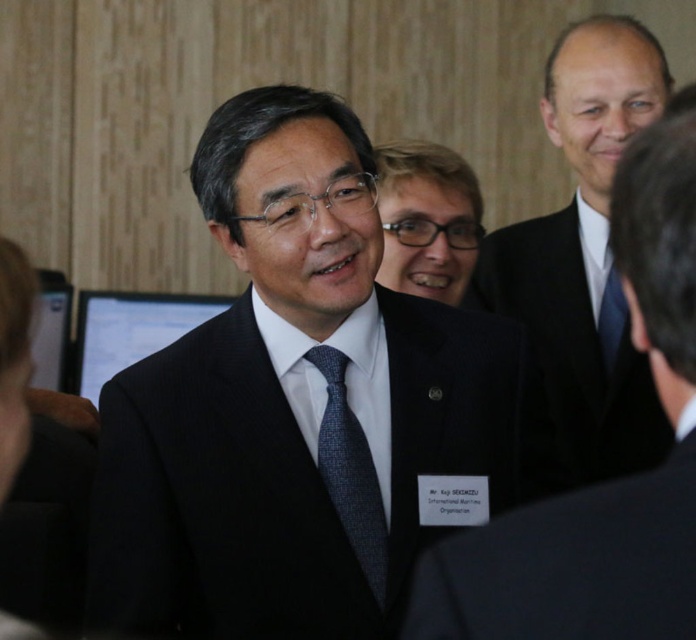
Question: Can you confirm if matte black suit at center is smaller than matte black monitor at left?

Choices:
 (A) no
 (B) yes

Answer: (B)

Question: Is black matte suit at center positioned in front of blue silk tie at right?

Choices:
 (A) no
 (B) yes

Answer: (B)

Question: Estimate the real-world distances between objects in this image. Which object is closer to the black matte suit at center?

Choices:
 (A) matte black monitor at center
 (B) matte black monitor at left

Answer: (A)

Question: Where is black matte suit at center located in relation to blue textured tie at center in the image?

Choices:
 (A) left
 (B) right

Answer: (B)

Question: Which point is closer to the camera?

Choices:
 (A) (335, 461)
 (B) (500, 561)

Answer: (B)

Question: Among these points, which one is nearest to the camera?

Choices:
 (A) (606, 432)
 (B) (355, 492)
 (C) (402, 284)

Answer: (B)